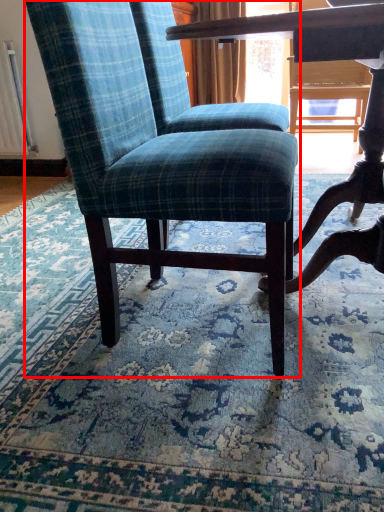
Question: Considering the relative positions of chair (annotated by the red box) and mat in the image provided, where is chair (annotated by the red box) located with respect to the staircase?

Choices:
 (A) right
 (B) left

Answer: (A)